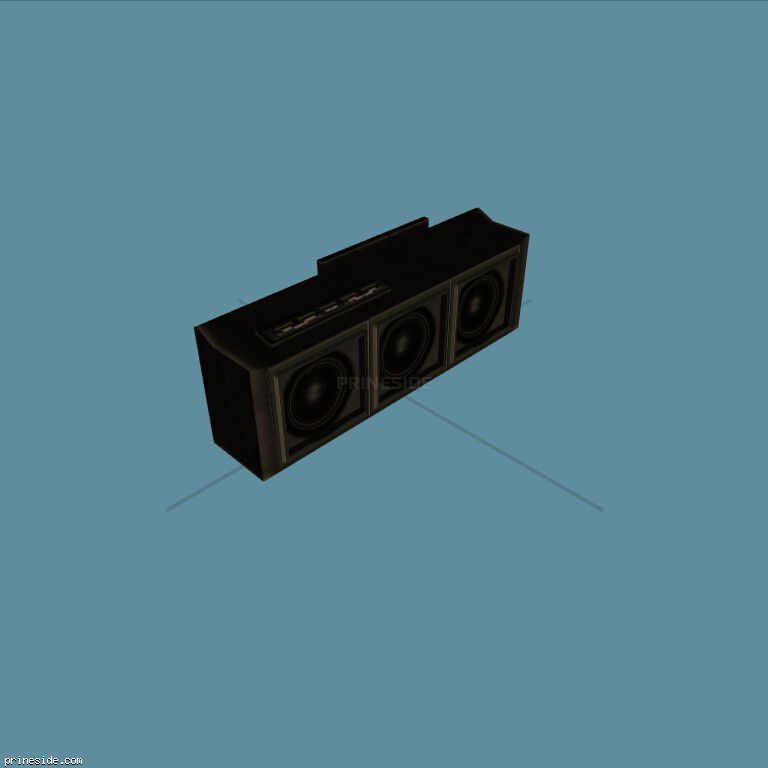
I want to click on speaker box, so click(246, 343).